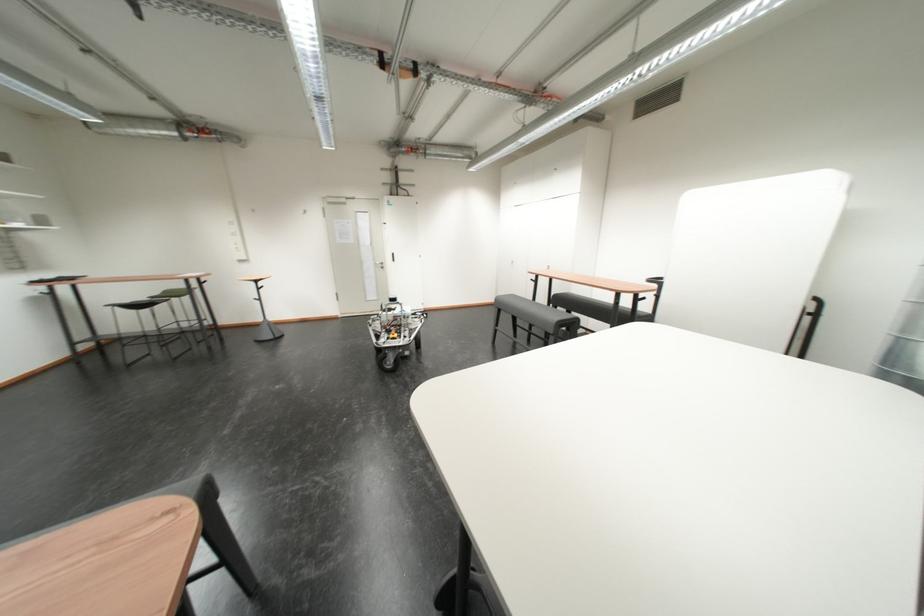
The height and width of the screenshot is (616, 924). In order to click on silver door handle in this screenshot , I will do [380, 265].